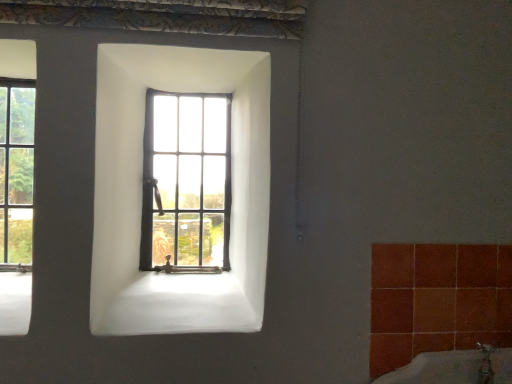
Question: Which direction should I rotate to look at wooden-framed window at center, positioned as the 1th window in right-to-left order?

Choices:
 (A) right
 (B) left

Answer: (B)

Question: Does clear glass window at left, which appears as the 2th window when viewed from the right, have a greater width compared to wooden-framed window at center, which is the 2th window from left to right?

Choices:
 (A) no
 (B) yes

Answer: (B)

Question: Considering the relative sizes of clear glass window at left, the 1th window positioned from the left, and wooden-framed window at center, which is the 2th window from left to right, in the image provided, is clear glass window at left, the 1th window positioned from the left, taller than wooden-framed window at center, which is the 2th window from left to right,?

Choices:
 (A) no
 (B) yes

Answer: (B)

Question: Is wooden-framed window at center, which is the 2th window from left to right, located within clear glass window at left, the 1th window positioned from the left?

Choices:
 (A) yes
 (B) no

Answer: (B)

Question: Is clear glass window at left, the 1th window positioned from the left, to the right of wooden-framed window at center, positioned as the 1th window in right-to-left order, from the viewer's perspective?

Choices:
 (A) no
 (B) yes

Answer: (A)

Question: Is clear glass window at left, the 1th window positioned from the left, at the left side of wooden-framed window at center, which is the 2th window from left to right?

Choices:
 (A) no
 (B) yes

Answer: (B)

Question: Can you confirm if clear glass window at left, which appears as the 2th window when viewed from the right, is bigger than wooden-framed window at center, positioned as the 1th window in right-to-left order?

Choices:
 (A) yes
 (B) no

Answer: (B)

Question: Is clear glass window at left, which appears as the 2th window when viewed from the right, at the back of wooden-framed window at center, which is the 2th window from left to right?

Choices:
 (A) no
 (B) yes

Answer: (A)

Question: Is wooden-framed window at center, positioned as the 1th window in right-to-left order, smaller than clear glass window at left, which appears as the 2th window when viewed from the right?

Choices:
 (A) yes
 (B) no

Answer: (B)

Question: Does wooden-framed window at center, positioned as the 1th window in right-to-left order, have a larger size compared to clear glass window at left, the 1th window positioned from the left?

Choices:
 (A) yes
 (B) no

Answer: (A)

Question: From the image's perspective, does wooden-framed window at center, positioned as the 1th window in right-to-left order, appear lower than clear glass window at left, the 1th window positioned from the left?

Choices:
 (A) no
 (B) yes

Answer: (B)

Question: Are wooden-framed window at center, which is the 2th window from left to right, and clear glass window at left, which appears as the 2th window when viewed from the right, far apart?

Choices:
 (A) no
 (B) yes

Answer: (A)

Question: Is wooden-framed window at center, which is the 2th window from left to right, closer to the viewer compared to clear glass window at left, which appears as the 2th window when viewed from the right?

Choices:
 (A) yes
 (B) no

Answer: (B)

Question: Is point (148, 226) closer or farther from the camera than point (33, 109)?

Choices:
 (A) farther
 (B) closer

Answer: (A)